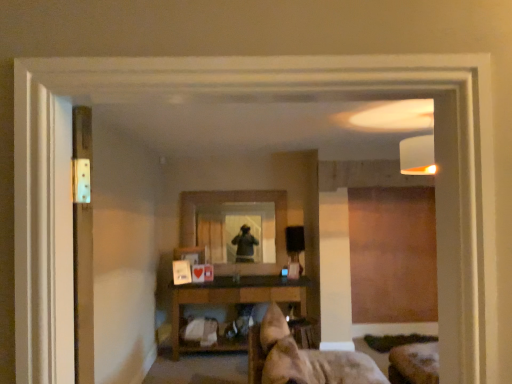
Question: Is brown wooden shelf at center positioned behind clear glass mirror at center?

Choices:
 (A) no
 (B) yes

Answer: (A)

Question: Are brown wooden shelf at center and clear glass mirror at center beside each other?

Choices:
 (A) yes
 (B) no

Answer: (B)

Question: From the image's perspective, is brown wooden shelf at center beneath clear glass mirror at center?

Choices:
 (A) yes
 (B) no

Answer: (A)

Question: Is clear glass mirror at center a part of brown wooden shelf at center?

Choices:
 (A) no
 (B) yes

Answer: (A)

Question: Is brown wooden shelf at center facing towards clear glass mirror at center?

Choices:
 (A) yes
 (B) no

Answer: (B)

Question: Does brown wooden shelf at center come in front of clear glass mirror at center?

Choices:
 (A) yes
 (B) no

Answer: (A)

Question: Does metallic silver screen door at left turn towards brown wooden shelf at center?

Choices:
 (A) yes
 (B) no

Answer: (B)

Question: From the image's perspective, is metallic silver screen door at left over brown wooden shelf at center?

Choices:
 (A) no
 (B) yes

Answer: (B)

Question: Is the depth of metallic silver screen door at left greater than that of brown wooden shelf at center?

Choices:
 (A) yes
 (B) no

Answer: (B)

Question: From a real-world perspective, is metallic silver screen door at left on top of brown wooden shelf at center?

Choices:
 (A) no
 (B) yes

Answer: (B)

Question: Does metallic silver screen door at left have a lesser width compared to brown wooden shelf at center?

Choices:
 (A) no
 (B) yes

Answer: (B)

Question: Would you consider metallic silver screen door at left to be distant from brown wooden shelf at center?

Choices:
 (A) no
 (B) yes

Answer: (B)

Question: Considering the relative sizes of metallic silver screen door at left and clear glass mirror at center in the image provided, is metallic silver screen door at left thinner than clear glass mirror at center?

Choices:
 (A) no
 (B) yes

Answer: (B)